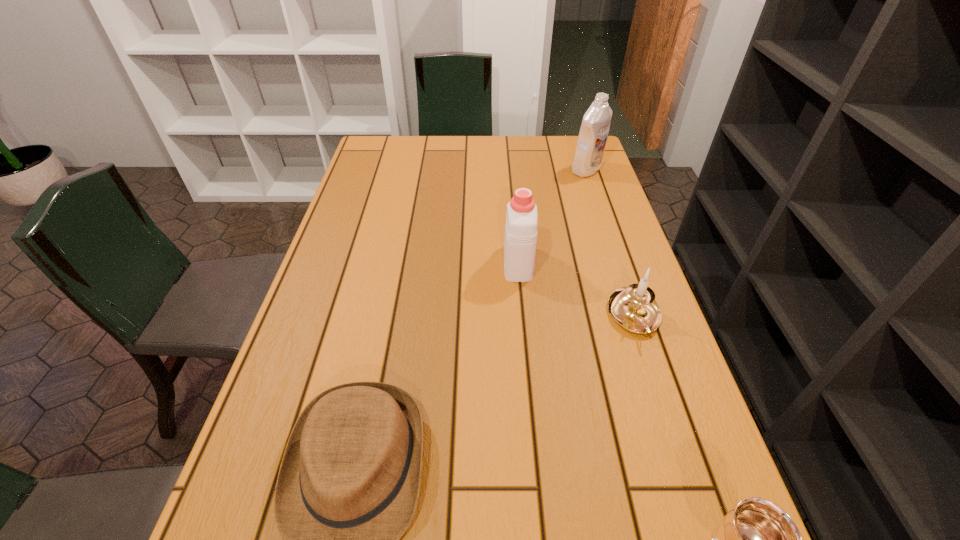
You are a GUI agent. You are given a task and a screenshot of the screen. Output one action in this format:
    pyautogui.click(x=<x>, y=<y>)
    Task: Click on the object that is at the far edge
    Image resolution: width=960 pixels, height=540 pixels.
    Given the screenshot: What is the action you would take?
    pyautogui.click(x=595, y=126)

You are a GUI agent. You are given a task and a screenshot of the screen. Output one action in this format:
    pyautogui.click(x=<x>, y=<y>)
    Task: Click on the detergent at the right edge
    Image resolution: width=960 pixels, height=540 pixels.
    Given the screenshot: What is the action you would take?
    pyautogui.click(x=595, y=126)

What are the coordinates of `candle holder located in the right edge section of the desktop` in the screenshot? It's located at (634, 308).

This screenshot has height=540, width=960. I want to click on object present at the far right corner, so click(595, 126).

In the image, there is a desktop. Identify the location of vacant space at the far edge. This screenshot has height=540, width=960. [x=412, y=166].

In the image, there is a desktop. At what (x,y) coordinates should I click in order to perform the action: click on free region at the left edge. Please return your answer as a coordinate pair (x, y). The image size is (960, 540). Looking at the image, I should click on (347, 216).

What are the coordinates of `vacant space at the right edge of the desktop` in the screenshot? It's located at (581, 251).

This screenshot has height=540, width=960. Identify the location of blank space at the far right corner of the desktop. (564, 146).

Identify the location of empty space that is in between the third farthest object and the second tallest object. (576, 290).

Image resolution: width=960 pixels, height=540 pixels. In order to click on free space between the candle holder and the farther detergent in this screenshot , I will do 611,244.